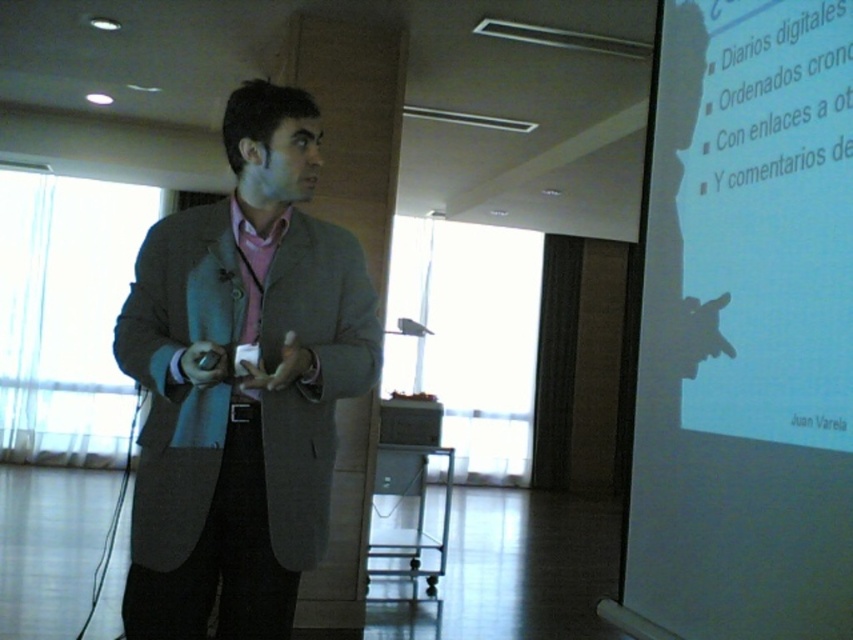
Question: From the image, what is the correct spatial relationship of white matte projection screen at right in relation to matte gray blazer at center?

Choices:
 (A) left
 (B) right

Answer: (B)

Question: Which point is closer to the camera?

Choices:
 (A) (763, 584)
 (B) (186, 540)

Answer: (A)

Question: Is white matte projection screen at right positioned behind matte gray blazer at center?

Choices:
 (A) no
 (B) yes

Answer: (A)

Question: Considering the relative positions of white matte projection screen at right and matte gray blazer at center in the image provided, where is white matte projection screen at right located with respect to matte gray blazer at center?

Choices:
 (A) above
 (B) below

Answer: (A)

Question: Which point is farther to the camera?

Choices:
 (A) (302, 561)
 (B) (700, 449)

Answer: (B)